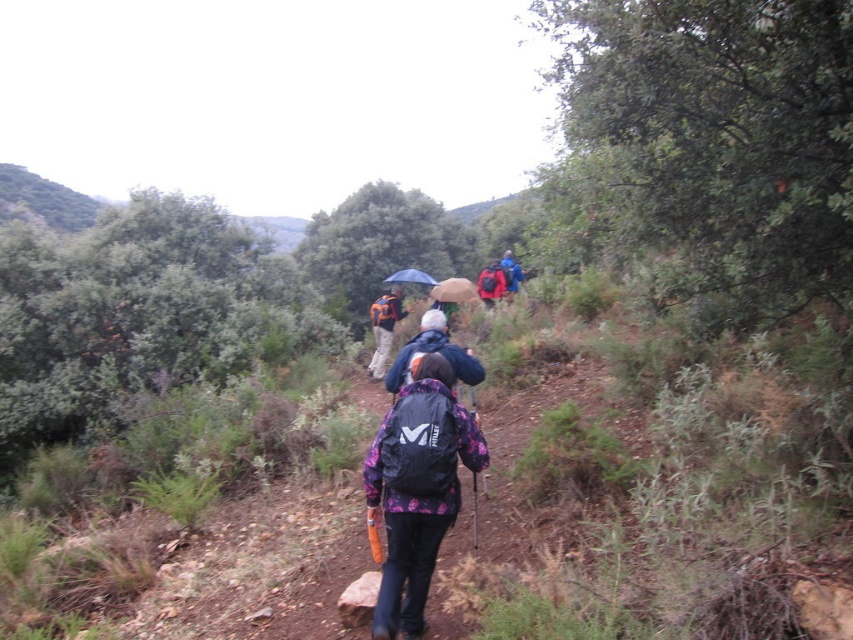
Who is taller, orange fabric backpack at center or blue matte umbrella at center?

orange fabric backpack at center

Is orange fabric backpack at center positioned at the back of blue matte umbrella at center?

No.

You are a GUI agent. You are given a task and a screenshot of the screen. Output one action in this format:
    pyautogui.click(x=<x>, y=<y>)
    Task: Click on the orange fabric backpack at center
    This screenshot has width=853, height=640.
    Given the screenshot: What is the action you would take?
    pyautogui.click(x=384, y=326)

Identify the location of orange fabric backpack at center. (384, 326).

Is the position of purple fleece jacket at center more distant than that of blue fabric umbrella at center?

No, purple fleece jacket at center is in front of blue fabric umbrella at center.

Is purple fleece jacket at center taller than blue fabric umbrella at center?

No.

This screenshot has height=640, width=853. What do you see at coordinates (416, 488) in the screenshot?
I see `purple fleece jacket at center` at bounding box center [416, 488].

Where is `purple fleece jacket at center`? This screenshot has height=640, width=853. purple fleece jacket at center is located at coordinates (416, 488).

Image resolution: width=853 pixels, height=640 pixels. What do you see at coordinates (433, 352) in the screenshot? I see `floral fabric backpack at center` at bounding box center [433, 352].

Is floral fabric backpack at center taller than blue fabric backpack at center?

No, floral fabric backpack at center is not taller than blue fabric backpack at center.

What do you see at coordinates (433, 352) in the screenshot? I see `floral fabric backpack at center` at bounding box center [433, 352].

Identify the location of floral fabric backpack at center. The width and height of the screenshot is (853, 640). (433, 352).